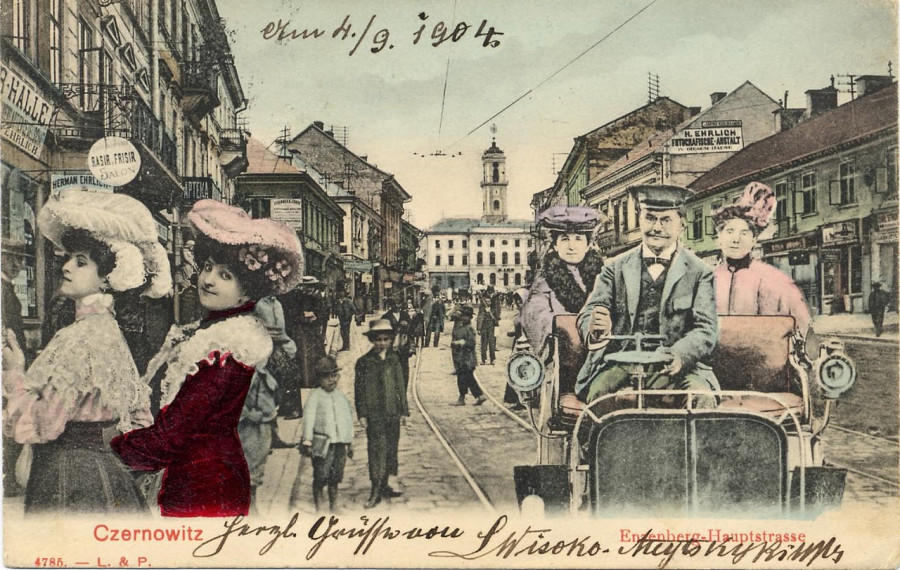
What are the coordinates of `coat` in the screenshot? It's located at (685, 276), (729, 280), (537, 292), (366, 374), (326, 410), (463, 335), (481, 316).